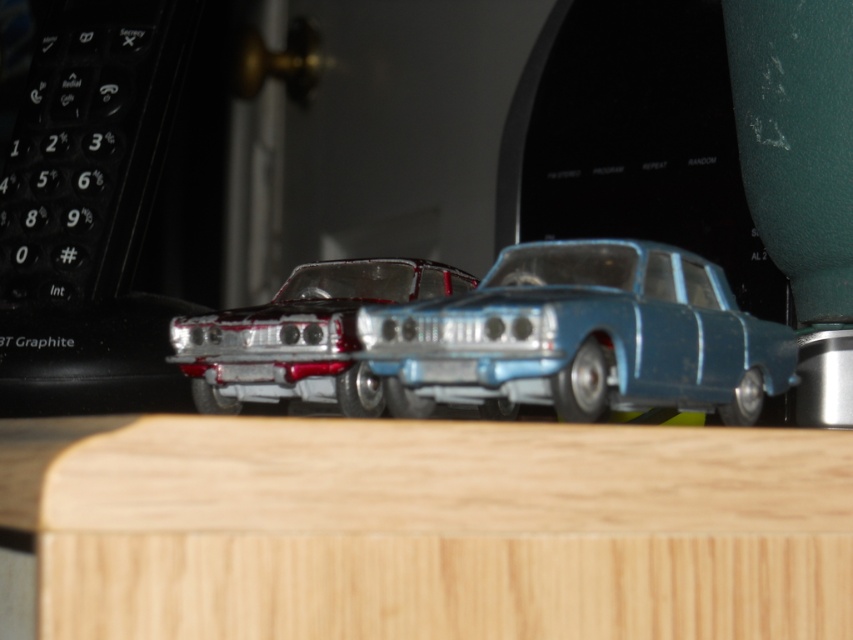
Question: From the image, what is the correct spatial relationship of blue metallic car at center in relation to shiny metallic car at center?

Choices:
 (A) right
 (B) left

Answer: (A)

Question: Can you confirm if light wood table at center is bigger than shiny metallic car at center?

Choices:
 (A) yes
 (B) no

Answer: (A)

Question: Which point is farther to the camera?

Choices:
 (A) (137, 570)
 (B) (293, 349)

Answer: (B)

Question: Which point is farther from the camera taking this photo?

Choices:
 (A) (473, 333)
 (B) (238, 324)
 (C) (508, 492)

Answer: (B)

Question: Does light wood table at center have a lesser width compared to blue metallic car at center?

Choices:
 (A) yes
 (B) no

Answer: (B)

Question: Which of the following is the farthest from the observer?

Choices:
 (A) shiny metallic car at center
 (B) blue metallic car at center
 (C) light wood table at center

Answer: (A)